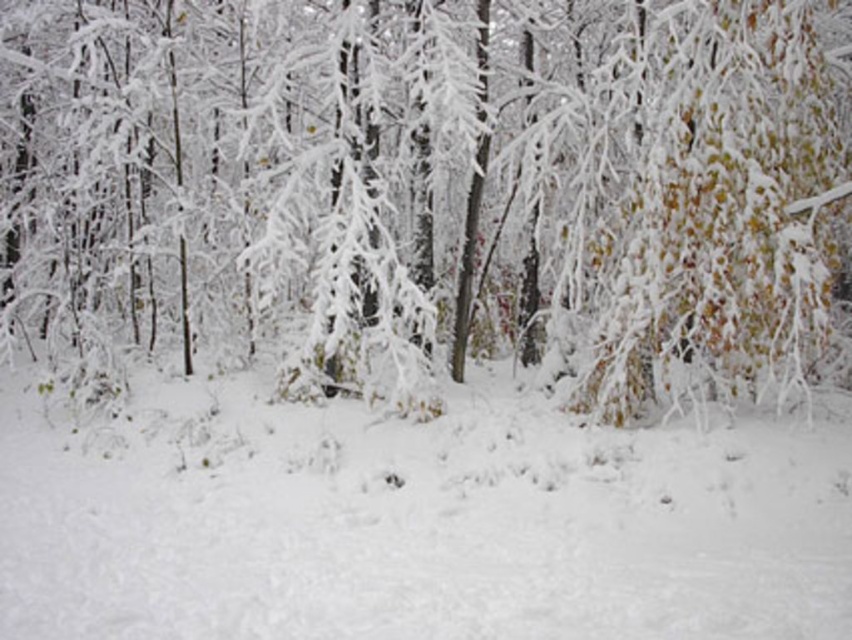
You are a hiker lost in a winter forest and see the white frosty tree at center. If you start walking directly towards the tree, will you encounter any obstacles on the path? Please refer to the scene description for context.

The scene description mentions that the ground is blanketed in thick white snow with faint tracks or impressions near the center. The white frosty tree at center is positioned at point (x=426, y=192). Since the snow appears undisturbed except for some faint tracks near the center, there are likely no significant obstacles on the path towards the white frosty tree at center. However, the faint tracks might indicate some minor disturbances, but they are not described as blocking the path. Therefore, the path is

You are standing in the winter forest and see the white frosty tree at center and the white fluffy snow at center. Which object is positioned to the right of the other?

The white frosty tree at center is to the right of white fluffy snow at center.